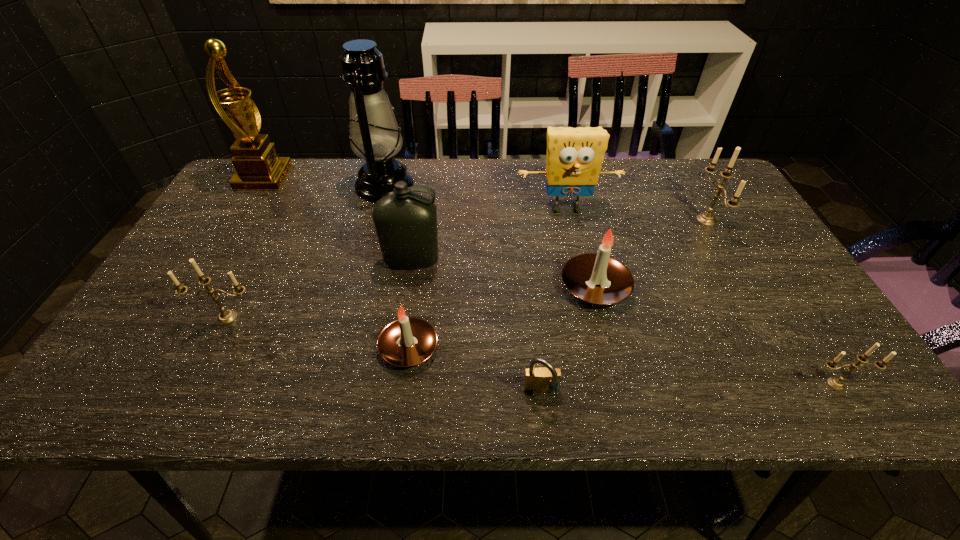
Select which candle is the second closest to the bottle. Please provide its 2D coordinates. Your answer should be formatted as a tuple, i.e. [(x, y)], where the tuple contains the x and y coordinates of a point satisfying the conditions above.

[(226, 317)]

You are a GUI agent. You are given a task and a screenshot of the screen. Output one action in this format:
    pyautogui.click(x=<x>, y=<y>)
    Task: Click on the candle that is the second nearest to the leftmost metallic candle
    Image resolution: width=960 pixels, height=540 pixels.
    Given the screenshot: What is the action you would take?
    pyautogui.click(x=598, y=278)

Identify which metallic candle is located as the nearest to the bottle. Please provide its 2D coordinates. Your answer should be formatted as a tuple, i.e. [(x, y)], where the tuple contains the x and y coordinates of a point satisfying the conditions above.

[(226, 317)]

Identify the location of metallic candle that is the second closest to the padlock. (226, 317).

Where is `free location that satisfies the following two spatial constraints: 1. on the front-facing side of the smaller white candle; 2. on the left side of the gold award`? This screenshot has height=540, width=960. free location that satisfies the following two spatial constraints: 1. on the front-facing side of the smaller white candle; 2. on the left side of the gold award is located at coordinates (161, 348).

At what (x,y) coordinates should I click in order to perform the action: click on vacant area that satisfies the following two spatial constraints: 1. on the back side of the tallest candle; 2. on the front-facing side of the award. Please return your answer as a coordinate pair (x, y). Looking at the image, I should click on (682, 178).

Where is `free space that satisfies the following two spatial constraints: 1. on the front-facing side of the tallest candle; 2. on the left side of the award`? The image size is (960, 540). free space that satisfies the following two spatial constraints: 1. on the front-facing side of the tallest candle; 2. on the left side of the award is located at coordinates (238, 220).

The image size is (960, 540). Find the location of `vacant space that satisfies the following two spatial constraints: 1. on the front-facing side of the gold award; 2. on the right side of the oil lamp`. vacant space that satisfies the following two spatial constraints: 1. on the front-facing side of the gold award; 2. on the right side of the oil lamp is located at coordinates (259, 186).